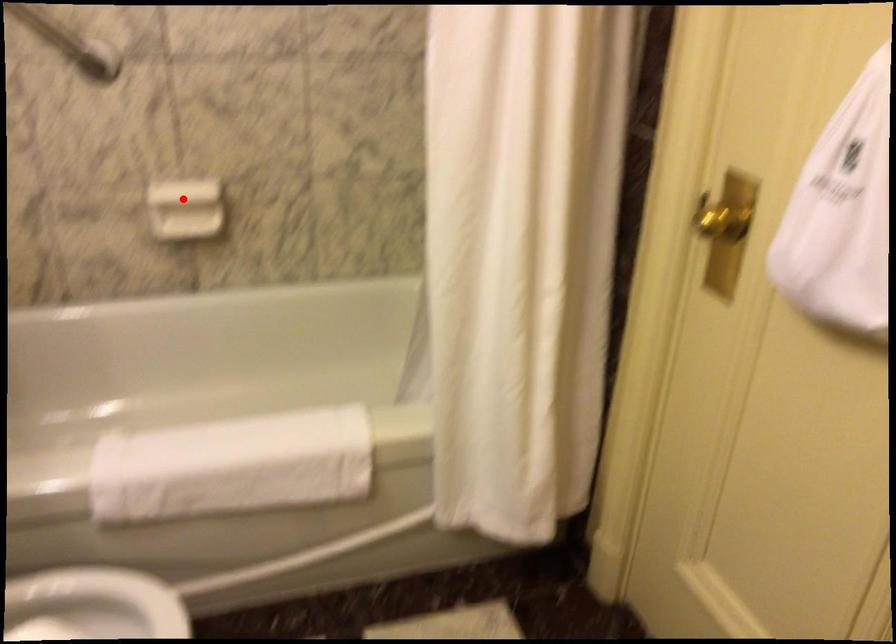
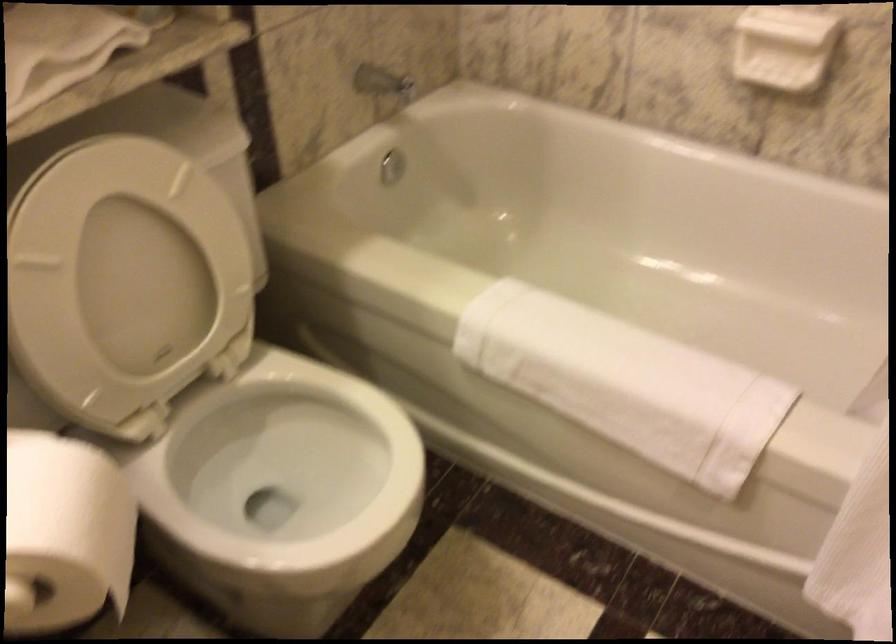
Where in the second image is the point corresponding to the highlighted location from the first image?

(782, 46)